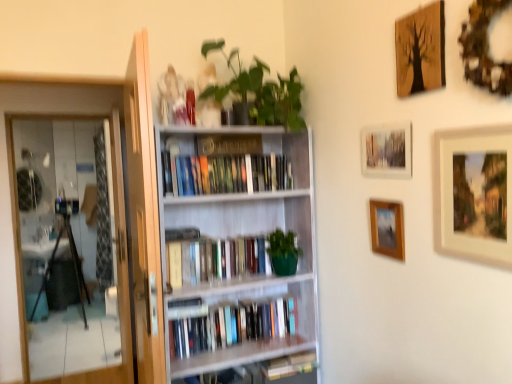
Question: Is white wooden bookcase at center shorter than green matte bookshelf at center, which is counted as the second book, starting from the top?

Choices:
 (A) no
 (B) yes

Answer: (A)

Question: Can you confirm if white wooden bookcase at center is taller than green matte bookshelf at center, the second book positioned from the bottom?

Choices:
 (A) no
 (B) yes

Answer: (B)

Question: From the image's perspective, does white wooden bookcase at center appear lower than green matte bookshelf at center, the second book positioned from the bottom?

Choices:
 (A) no
 (B) yes

Answer: (B)

Question: Is white wooden bookcase at center next to green matte bookshelf at center, the second book positioned from the bottom, and touching it?

Choices:
 (A) yes
 (B) no

Answer: (B)

Question: Is white wooden bookcase at center completely or partially outside of green matte bookshelf at center, the second book positioned from the bottom?

Choices:
 (A) yes
 (B) no

Answer: (A)

Question: Can you confirm if white wooden bookcase at center is thinner than green matte bookshelf at center, which is counted as the second book, starting from the top?

Choices:
 (A) no
 (B) yes

Answer: (A)

Question: Is white wooden bookcase at center thinner than transparent glass screen door at left?

Choices:
 (A) no
 (B) yes

Answer: (A)

Question: Is white wooden bookcase at center completely or partially outside of transparent glass screen door at left?

Choices:
 (A) no
 (B) yes

Answer: (B)

Question: Is white wooden bookcase at center positioned behind transparent glass screen door at left?

Choices:
 (A) yes
 (B) no

Answer: (B)

Question: Does white wooden bookcase at center have a greater width compared to transparent glass screen door at left?

Choices:
 (A) yes
 (B) no

Answer: (A)

Question: Is transparent glass screen door at left inside white wooden bookcase at center?

Choices:
 (A) no
 (B) yes

Answer: (A)

Question: Can you confirm if white wooden bookcase at center is taller than transparent glass screen door at left?

Choices:
 (A) no
 (B) yes

Answer: (A)

Question: From the image's perspective, is wooden picture frame at center-right, positioned as the fourth picture frame in top-to-bottom order, below transparent glass screen door at left?

Choices:
 (A) yes
 (B) no

Answer: (B)